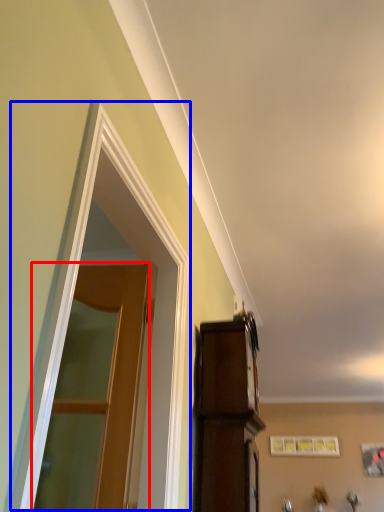
Question: Which of the following is the farthest to the observer, door (highlighted by a red box) or window (highlighted by a blue box)?

Choices:
 (A) door
 (B) window

Answer: (A)